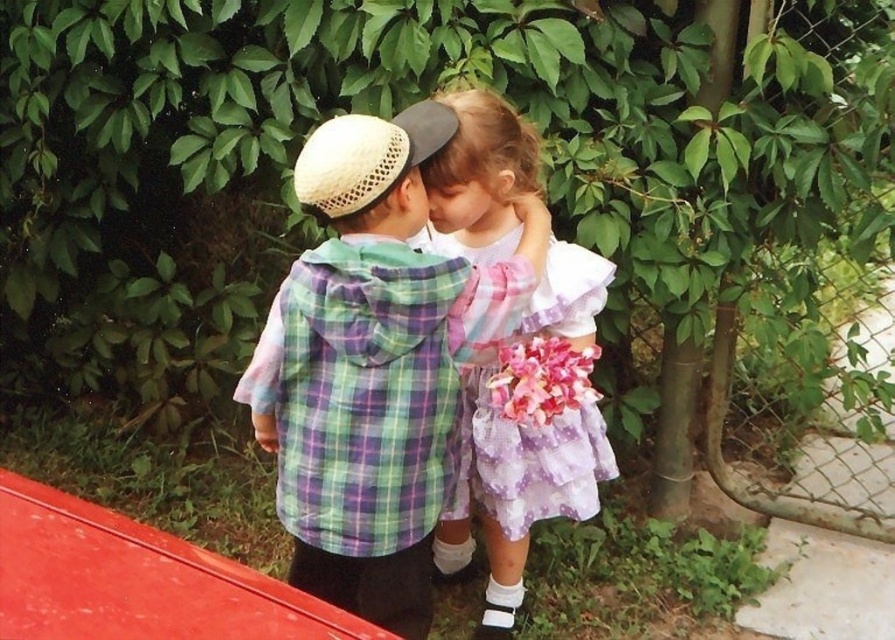
You are a photographer trying to capture the children in the scene. You notice a point at coordinates (373, 365). What object is located at that point?

The point at coordinates (373, 365) marks the plaid fabric shirt at center.

You are a photographer trying to capture a closeup of the pink fabric flower at center while ensuring the purple polka dot dress at center is still visible in the frame. Can you fit both in the shot without moving the camera?

The purple polka dot dress at center is taller than the pink fabric flower at center, so the photographer can fit both in the shot without moving the camera as the dress is taller and would naturally frame the flower in the composition.

Based on the scene described, which clothing item, the plaid fabric shirt at center or the purple polka dot dress at center, is taller?

The plaid fabric shirt at center is taller than the purple polka dot dress at center according to the description.